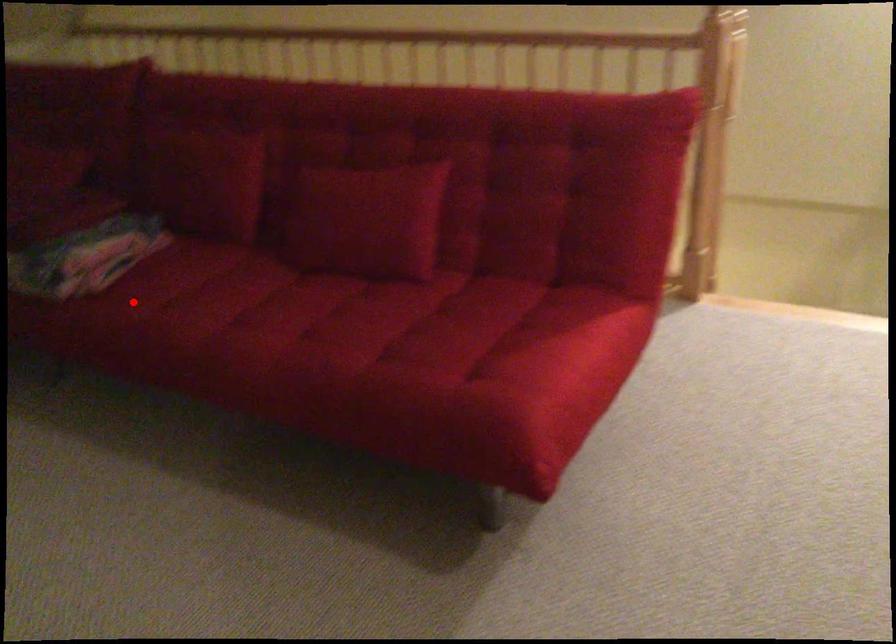
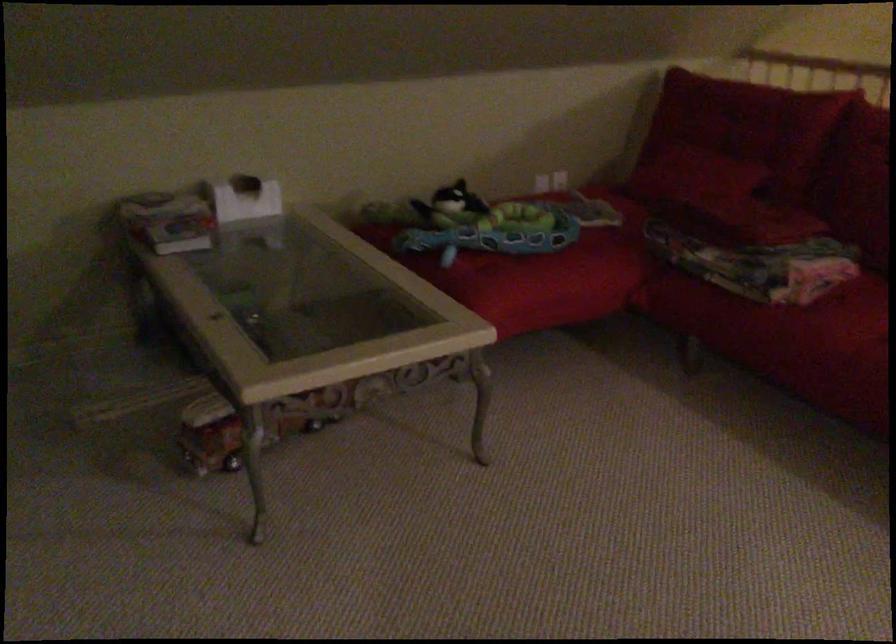
Find the pixel in the second image that matches the highlighted location in the first image.

(843, 317)